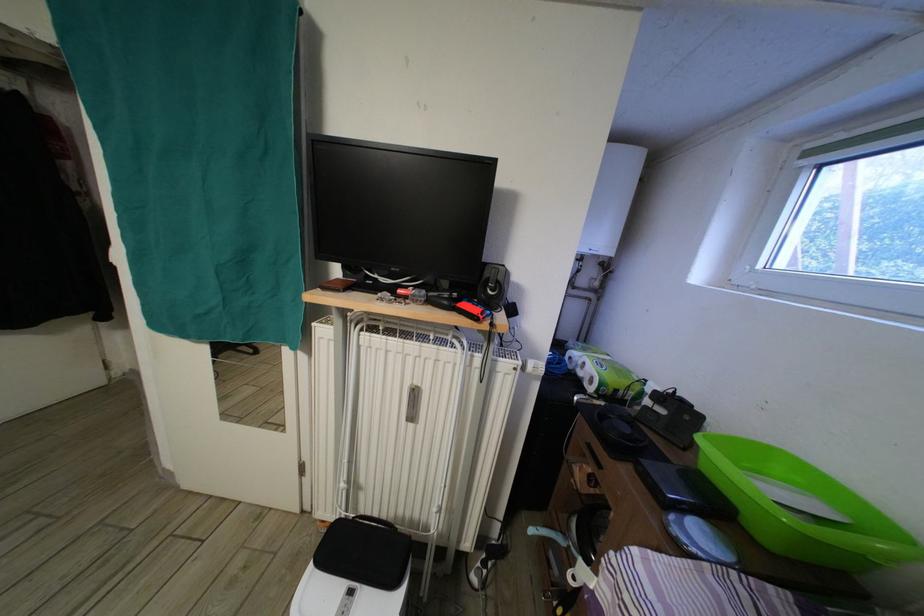
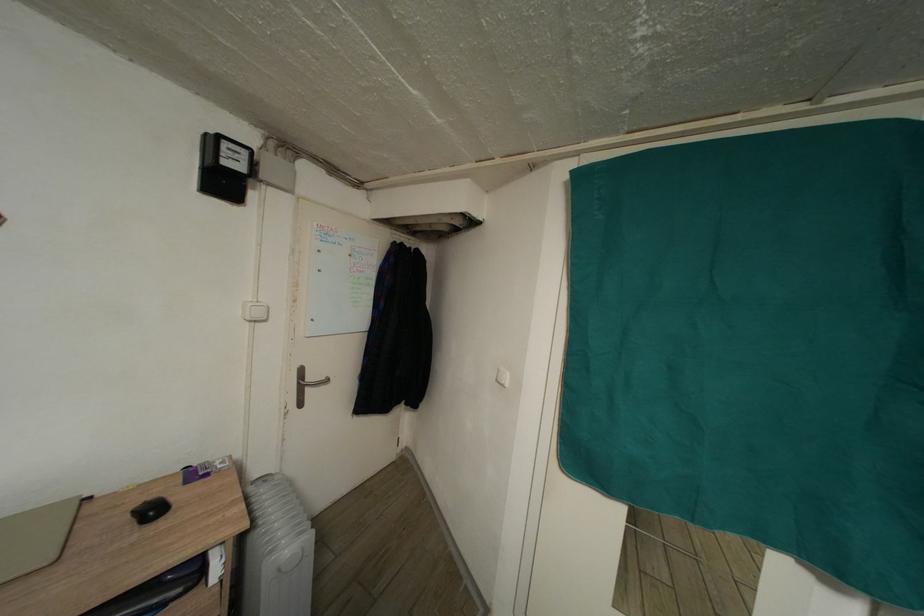
Question: The images are taken continuously from a first-person perspective. In which direction are you moving?

Choices:
 (A) Left
 (B) Right
 (C) Forward
 (D) Backward

Answer: (A)